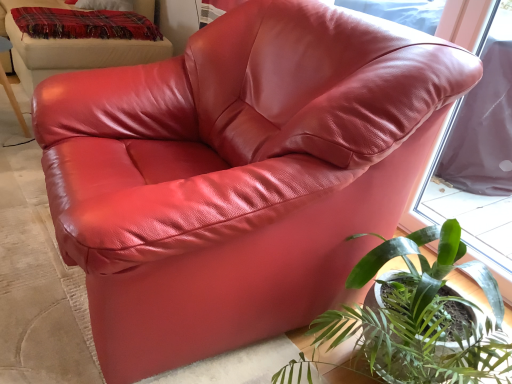
Question: Is satin red bean bag at upper right thinner than plaid woolen blanket at upper left?

Choices:
 (A) yes
 (B) no

Answer: (B)

Question: Can you confirm if satin red bean bag at upper right is wider than plaid woolen blanket at upper left?

Choices:
 (A) no
 (B) yes

Answer: (B)

Question: Is plaid woolen blanket at upper left inside satin red bean bag at upper right?

Choices:
 (A) yes
 (B) no

Answer: (A)

Question: Can you confirm if satin red bean bag at upper right is bigger than plaid woolen blanket at upper left?

Choices:
 (A) no
 (B) yes

Answer: (B)

Question: Is satin red bean bag at upper right at the right side of plaid woolen blanket at upper left?

Choices:
 (A) yes
 (B) no

Answer: (B)

Question: From a real-world perspective, is satin red bean bag at upper right physically above plaid woolen blanket at upper left?

Choices:
 (A) yes
 (B) no

Answer: (B)

Question: Is green leafy plant at lower right at the left side of plaid woolen blanket at upper left?

Choices:
 (A) yes
 (B) no

Answer: (B)

Question: Does green leafy plant at lower right have a greater width compared to plaid woolen blanket at upper left?

Choices:
 (A) yes
 (B) no

Answer: (B)

Question: Is green leafy plant at lower right looking in the opposite direction of plaid woolen blanket at upper left?

Choices:
 (A) yes
 (B) no

Answer: (B)

Question: Is plaid woolen blanket at upper left completely or partially inside green leafy plant at lower right?

Choices:
 (A) yes
 (B) no

Answer: (B)

Question: Does green leafy plant at lower right have a smaller size compared to plaid woolen blanket at upper left?

Choices:
 (A) no
 (B) yes

Answer: (A)

Question: Is green leafy plant at lower right positioned before plaid woolen blanket at upper left?

Choices:
 (A) no
 (B) yes

Answer: (B)

Question: Is satin red bean bag at upper right looking in the opposite direction of green leafy plant at lower right?

Choices:
 (A) yes
 (B) no

Answer: (B)